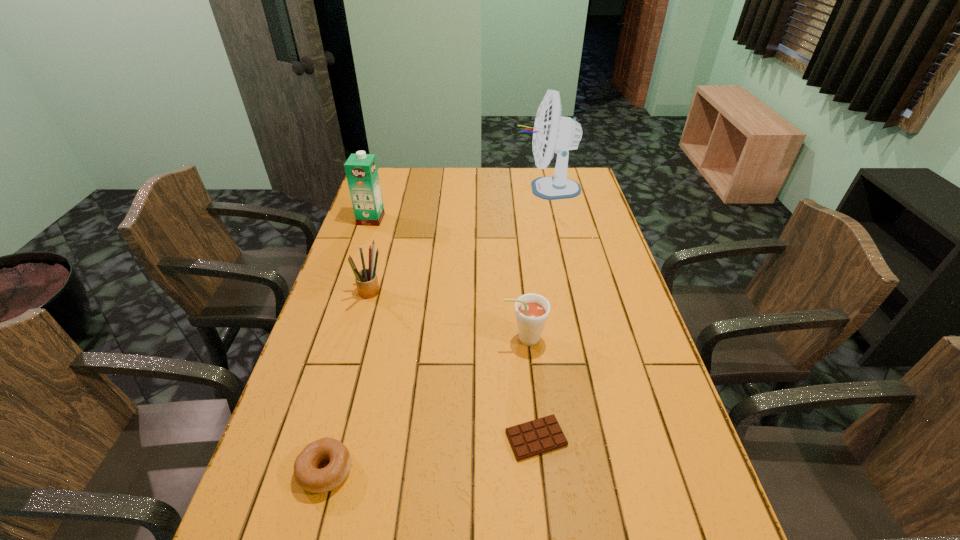
Where is `vacant area that lies between the shortest object and the pencil box`? The height and width of the screenshot is (540, 960). vacant area that lies between the shortest object and the pencil box is located at coordinates (453, 366).

You are a GUI agent. You are given a task and a screenshot of the screen. Output one action in this format:
    pyautogui.click(x=<x>, y=<y>)
    Task: Click on the free space between the farthest object and the carton
    The width and height of the screenshot is (960, 540).
    Given the screenshot: What is the action you would take?
    pyautogui.click(x=459, y=204)

Locate an element on the screen. The height and width of the screenshot is (540, 960). free space that is in between the fourth farthest object and the farthest object is located at coordinates click(x=536, y=264).

Locate an element on the screen. This screenshot has height=540, width=960. vacant point located between the root beer and the tallest object is located at coordinates (536, 264).

Identify the location of unoccupied position between the third nearest object and the pencil box. (447, 316).

Locate an element on the screen. object that is the second closest to the bagel is located at coordinates (532, 310).

This screenshot has height=540, width=960. What are the coordinates of `the fifth closest object to the pencil box` in the screenshot? It's located at (552, 132).